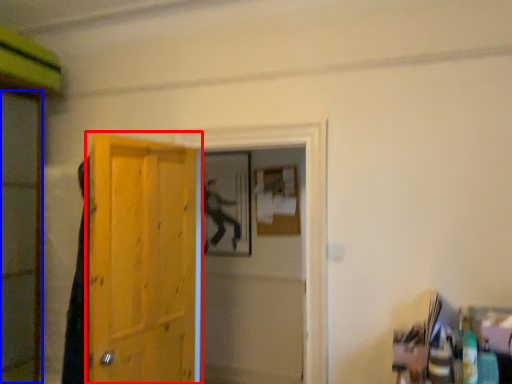
Question: Which point is closer to the camera, door (highlighted by a red box) or screen door (highlighted by a blue box)?

Choices:
 (A) door
 (B) screen door

Answer: (A)